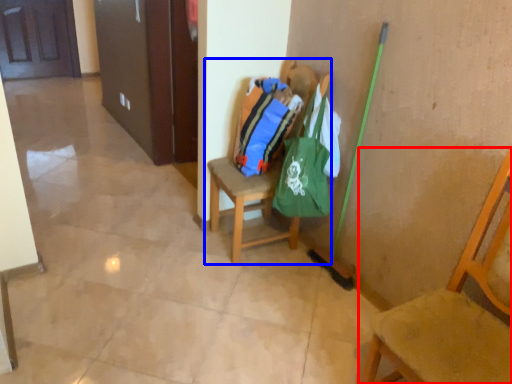
Question: Which point is closer to the camera, chair (highlighted by a red box) or chair (highlighted by a blue box)?

Choices:
 (A) chair
 (B) chair

Answer: (A)